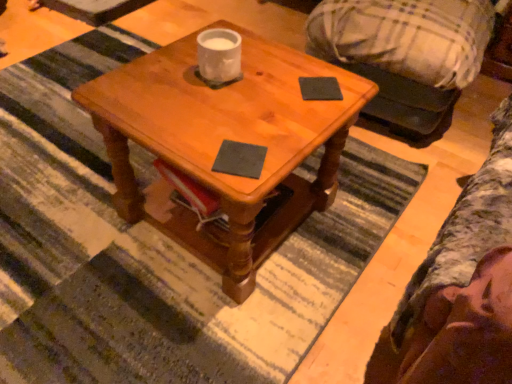
The width and height of the screenshot is (512, 384). What are the coordinates of `vacant space in front of black matte notepad at upper right, which appears as the first notepad when viewed from the right` in the screenshot? It's located at (305, 120).